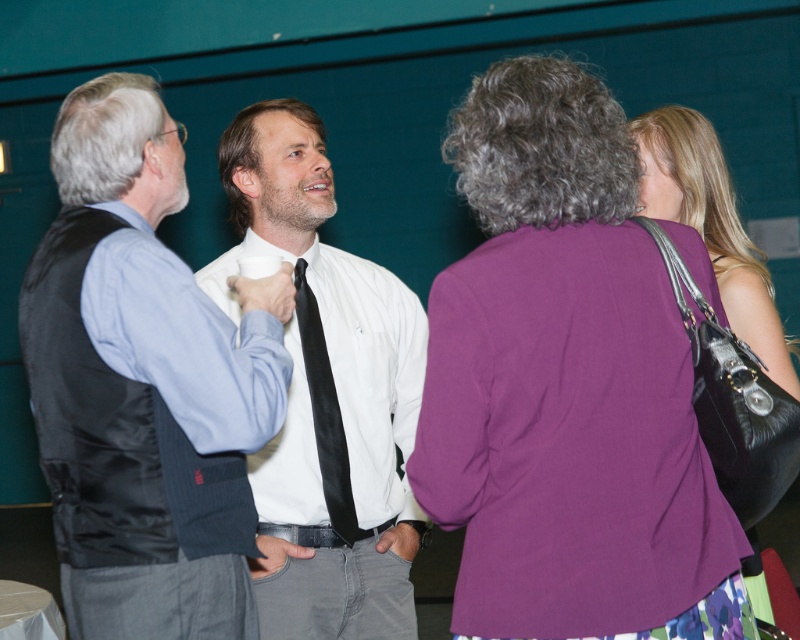
Is matte black vest at left below leather handbag at right?

Correct, matte black vest at left is located below leather handbag at right.

Between matte black vest at left and leather handbag at right, which one is positioned higher?

leather handbag at right

Identify the location of matte black vest at left. (144, 384).

Find the location of a particular element. The height and width of the screenshot is (640, 800). matte black vest at left is located at coordinates (144, 384).

Can you confirm if white glossy shirt at center is positioned below black silk tie at center?

No.

Who is more distant from viewer, (352, 260) or (318, 358)?

Point (352, 260)

Find the location of `white glossy shirt at center`. white glossy shirt at center is located at coordinates (326, 396).

Is matte black vest at left below white glossy shirt at center?

Incorrect, matte black vest at left is not positioned below white glossy shirt at center.

Who is more forward, (226, 564) or (332, 522)?

Positioned in front is point (226, 564).

At what (x,y) coordinates should I click in order to perform the action: click on matte black vest at left. Please return your answer as a coordinate pair (x, y). The width and height of the screenshot is (800, 640). Looking at the image, I should click on (144, 384).